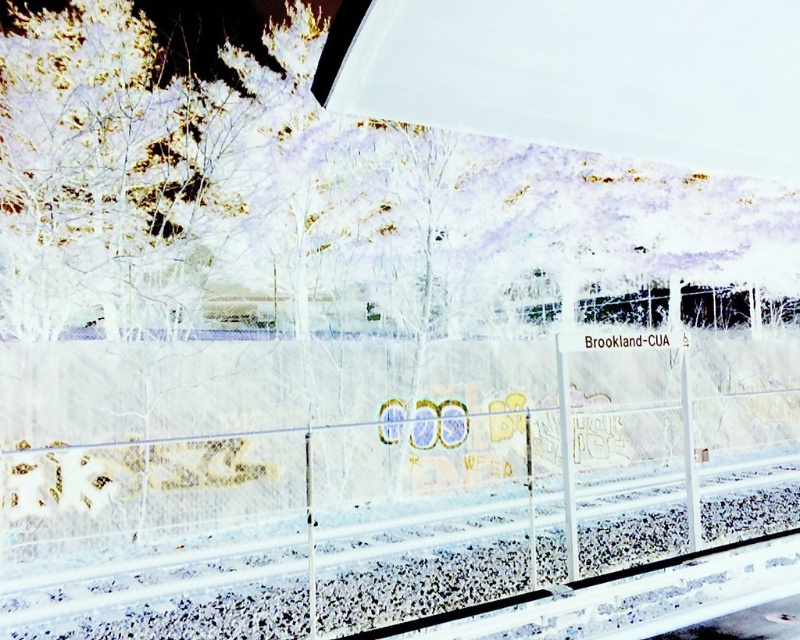
Question: Is white matte canopy at upper center bigger than smooth concrete train track at center?

Choices:
 (A) no
 (B) yes

Answer: (A)

Question: Which object is farther from the camera taking this photo?

Choices:
 (A) smooth concrete train track at center
 (B) white matte canopy at upper center

Answer: (A)

Question: Does white matte canopy at upper center have a smaller size compared to smooth concrete train track at center?

Choices:
 (A) yes
 (B) no

Answer: (A)

Question: Which point appears closest to the camera in this image?

Choices:
 (A) (774, 524)
 (B) (798, 28)

Answer: (B)

Question: Can you confirm if white matte canopy at upper center is thinner than smooth concrete train track at center?

Choices:
 (A) no
 (B) yes

Answer: (B)

Question: Among these objects, which one is farthest from the camera?

Choices:
 (A) smooth concrete train track at center
 (B) white matte canopy at upper center

Answer: (A)